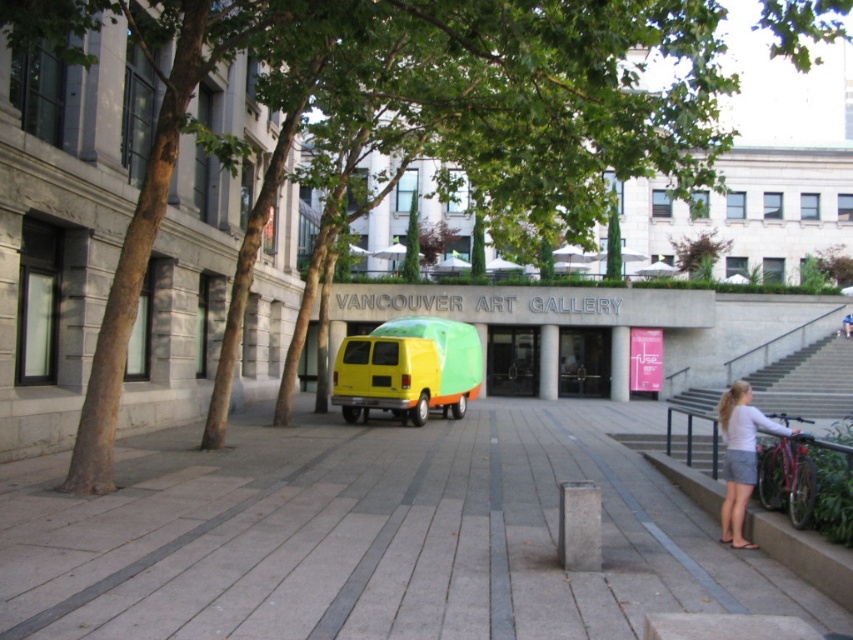
Question: Among these points, which one is farthest from the camera?

Choices:
 (A) (737, 387)
 (B) (381, 392)
 (C) (801, 413)

Answer: (C)

Question: Which point appears closest to the camera in this image?

Choices:
 (A) pyautogui.click(x=352, y=628)
 (B) pyautogui.click(x=701, y=388)

Answer: (A)

Question: Which point is closer to the camera?

Choices:
 (A) light brown leather jacket at lower right
 (B) concrete stairs at right
 (C) light gray cotton skirt at lower right

Answer: (C)

Question: Is gray concrete pavement at center to the right of yellow matte van at center from the viewer's perspective?

Choices:
 (A) yes
 (B) no

Answer: (B)

Question: Is gray concrete pavement at center further to the viewer compared to light gray cotton skirt at lower right?

Choices:
 (A) yes
 (B) no

Answer: (B)

Question: Can you confirm if gray concrete pavement at center is bigger than yellow matte van at center?

Choices:
 (A) yes
 (B) no

Answer: (B)